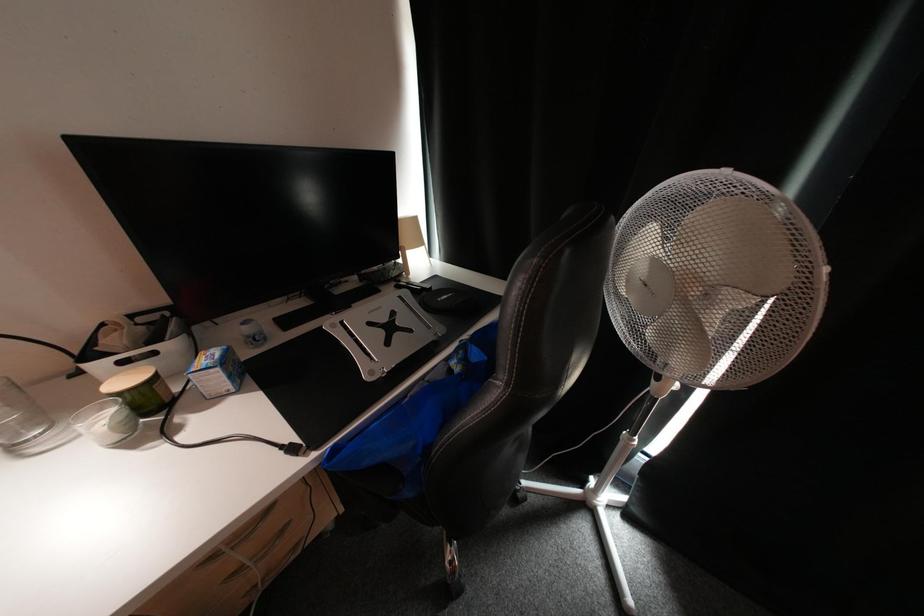
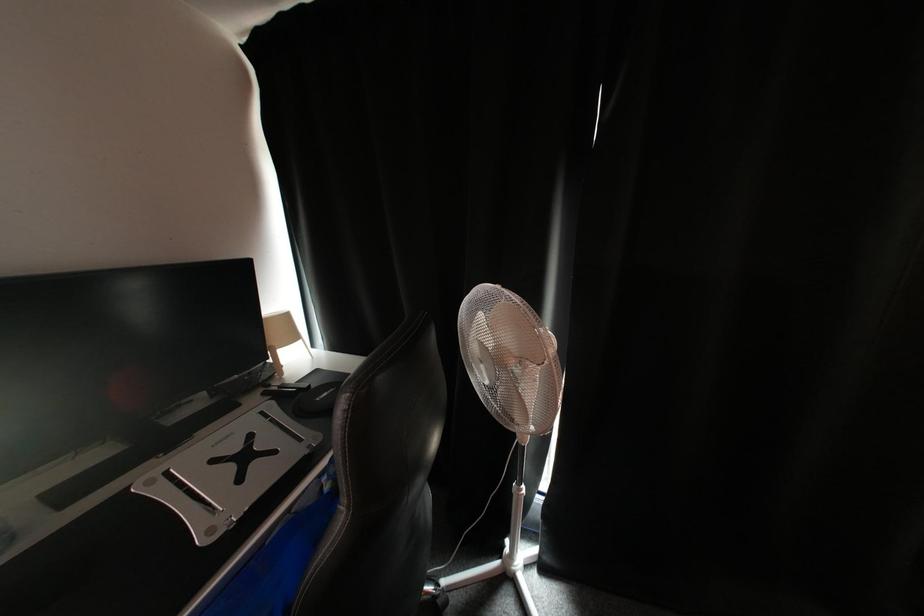
Question: The first image is from the beginning of the video and the second image is from the end. How did the camera likely rotate when shooting the video?

Choices:
 (A) Left
 (B) Right
 (C) Up
 (D) Down

Answer: (B)